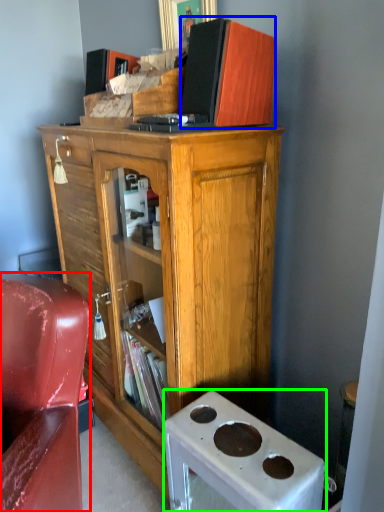
Question: Which is nearer to the chair (highlighted by a red box)? book (highlighted by a blue box) or desk (highlighted by a green box).

Choices:
 (A) book
 (B) desk

Answer: (B)